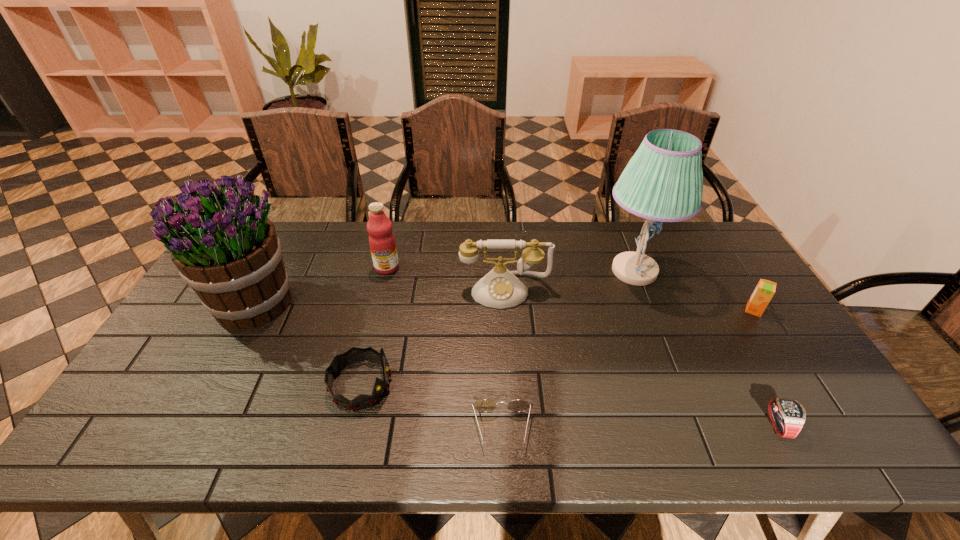
Choose which object is the fourth nearest neighbor to the rightmost object. Please provide its 2D coordinates. Your answer should be formatted as a tuple, i.e. [(x, y)], where the tuple contains the x and y coordinates of a point satisfying the conditions above.

[(485, 405)]

Where is `vacant space that satisfies the following two spatial constraints: 1. on the dial of the telephone; 2. on the left side of the rightmost object`? The image size is (960, 540). vacant space that satisfies the following two spatial constraints: 1. on the dial of the telephone; 2. on the left side of the rightmost object is located at coordinates (506, 310).

Find the location of a particular element. vacant region that satisfies the following two spatial constraints: 1. on the back side of the watch; 2. at the front of the tiara with jewels is located at coordinates click(x=754, y=384).

You are a GUI agent. You are given a task and a screenshot of the screen. Output one action in this format:
    pyautogui.click(x=<x>, y=<y>)
    Task: Click on the free spot that satisfies the following two spatial constraints: 1. at the front of the tiara with jewels; 2. on the left side of the seventh object from left to right
    
    Given the screenshot: What is the action you would take?
    pyautogui.click(x=351, y=425)